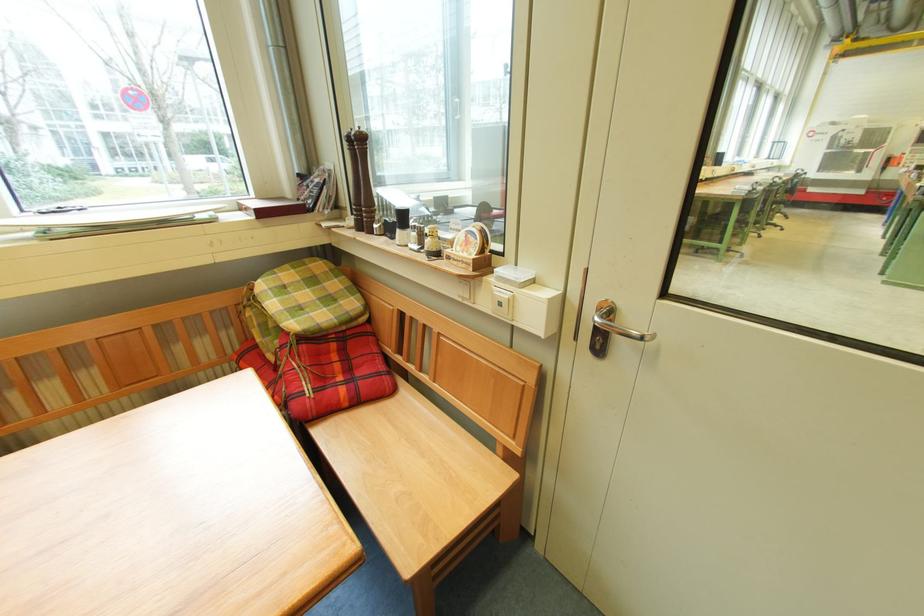
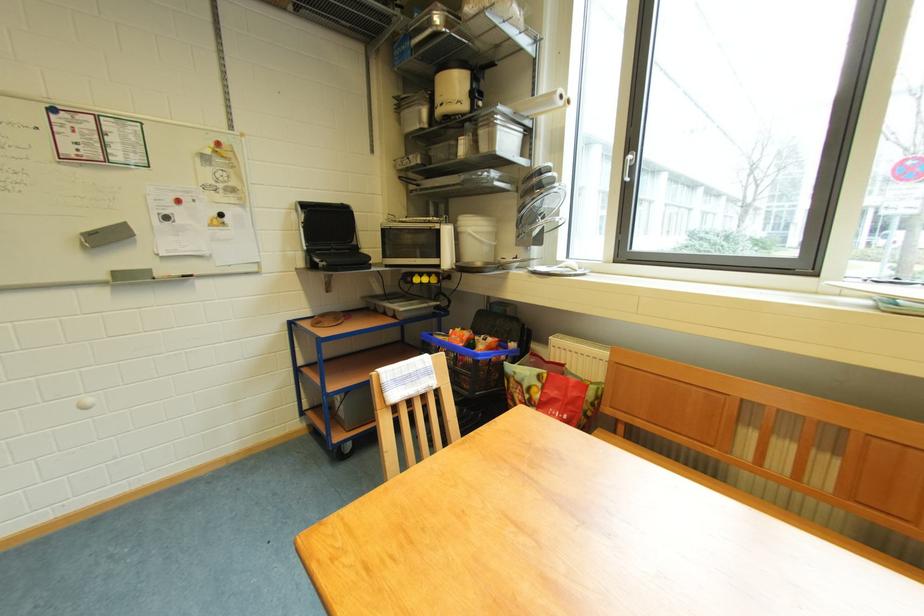
Question: Based on the continuous images, in which direction is the camera rotating? Reply with the corresponding letter.

Choices:
 (A) Left
 (B) Right
 (C) Up
 (D) Down

Answer: (A)